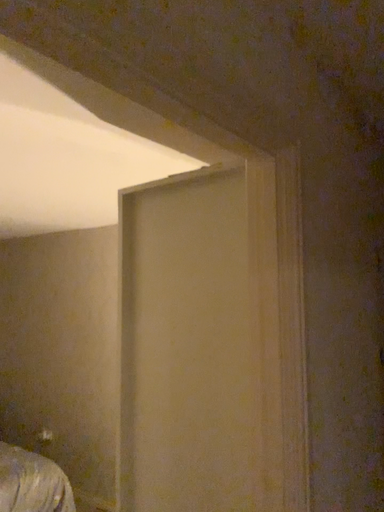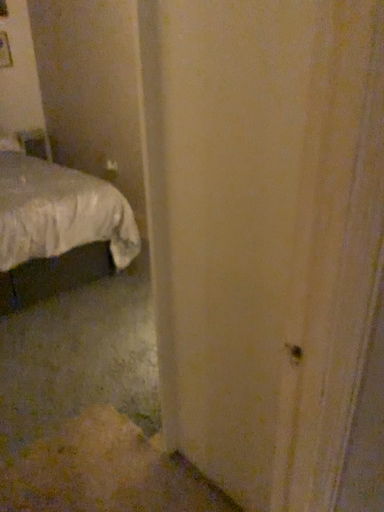
Question: Which way did the camera rotate in the video?

Choices:
 (A) rotated right
 (B) rotated left

Answer: (B)